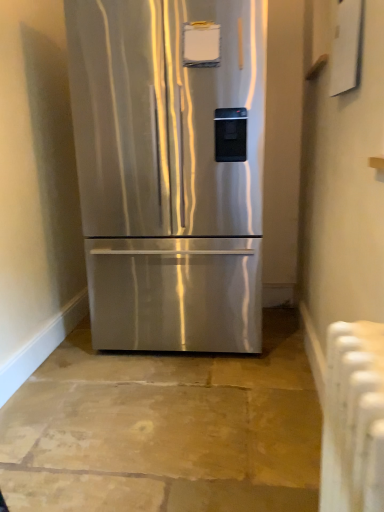
Question: Is white plastic radiator at lower right outside stainless steel refrigerator at center?

Choices:
 (A) no
 (B) yes

Answer: (B)

Question: From a real-world perspective, does white plastic radiator at lower right sit lower than stainless steel refrigerator at center?

Choices:
 (A) no
 (B) yes

Answer: (B)

Question: Considering the relative sizes of white plastic radiator at lower right and stainless steel refrigerator at center in the image provided, is white plastic radiator at lower right shorter than stainless steel refrigerator at center?

Choices:
 (A) yes
 (B) no

Answer: (A)

Question: From the image's perspective, is white plastic radiator at lower right located beneath stainless steel refrigerator at center?

Choices:
 (A) no
 (B) yes

Answer: (B)

Question: Can you confirm if white plastic radiator at lower right is wider than stainless steel refrigerator at center?

Choices:
 (A) yes
 (B) no

Answer: (B)

Question: Is white plastic radiator at lower right thinner than stainless steel refrigerator at center?

Choices:
 (A) yes
 (B) no

Answer: (A)

Question: From the image's perspective, is stainless steel refrigerator at center on white plastic radiator at lower right?

Choices:
 (A) no
 (B) yes

Answer: (B)

Question: From a real-world perspective, is stainless steel refrigerator at center physically above white plastic radiator at lower right?

Choices:
 (A) no
 (B) yes

Answer: (B)

Question: Is stainless steel refrigerator at center looking in the opposite direction of white plastic radiator at lower right?

Choices:
 (A) yes
 (B) no

Answer: (B)

Question: Is stainless steel refrigerator at center taller than white plastic radiator at lower right?

Choices:
 (A) yes
 (B) no

Answer: (A)

Question: Considering the relative sizes of stainless steel refrigerator at center and white plastic radiator at lower right in the image provided, is stainless steel refrigerator at center bigger than white plastic radiator at lower right?

Choices:
 (A) no
 (B) yes

Answer: (B)

Question: Can you confirm if stainless steel refrigerator at center is shorter than white plastic radiator at lower right?

Choices:
 (A) no
 (B) yes

Answer: (A)

Question: From the image's perspective, is stainless steel refrigerator at center positioned above or below white plastic radiator at lower right?

Choices:
 (A) below
 (B) above

Answer: (B)